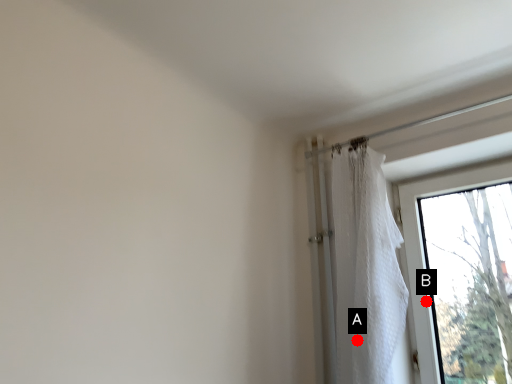
Question: Two points are circled on the image, labeled by A and B beside each circle. Which of the following is the farthest from the observer?

Choices:
 (A) A is further
 (B) B is further

Answer: (B)